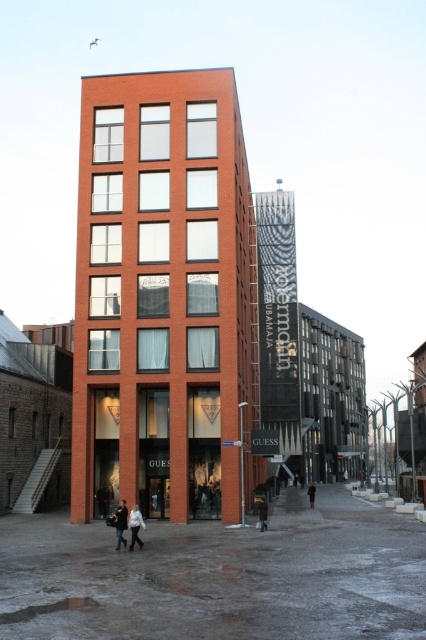
The height and width of the screenshot is (640, 426). Find the location of `brick building at center`. brick building at center is located at coordinates (163, 296).

Is point (103, 301) farther from viewer compared to point (132, 524)?

That is True.

Where is `brick building at center`? brick building at center is located at coordinates (163, 296).

Is white cotton jacket at lower center wider than dark brown leather coat at lower center?

No, white cotton jacket at lower center is not wider than dark brown leather coat at lower center.

Which is above, white cotton jacket at lower center or dark brown leather coat at lower center?

white cotton jacket at lower center is above.

Between point (118, 529) and point (310, 500), which one is positioned in front?

Positioned in front is point (118, 529).

Locate an element on the screen. This screenshot has height=640, width=426. white cotton jacket at lower center is located at coordinates (120, 524).

Can you confirm if white matte jacket at lower center is wider than dark brown leather jacket at lower center?

Incorrect, white matte jacket at lower center's width does not surpass dark brown leather jacket at lower center's.

Does white matte jacket at lower center appear under dark brown leather jacket at lower center?

No, white matte jacket at lower center is not below dark brown leather jacket at lower center.

Who is more forward, (132, 515) or (261, 504)?

Point (132, 515)

Identify the location of white matte jacket at lower center. Image resolution: width=426 pixels, height=640 pixels. (135, 525).